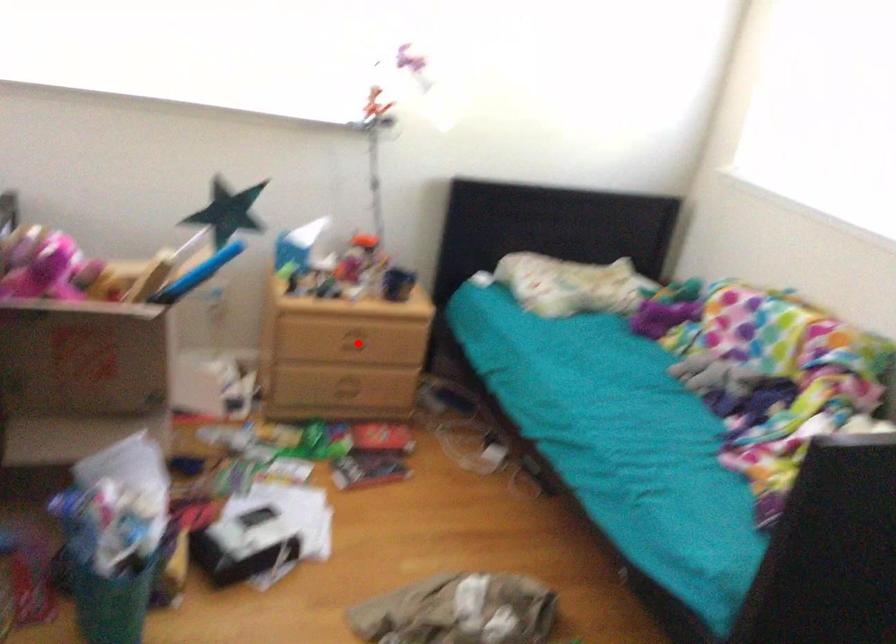
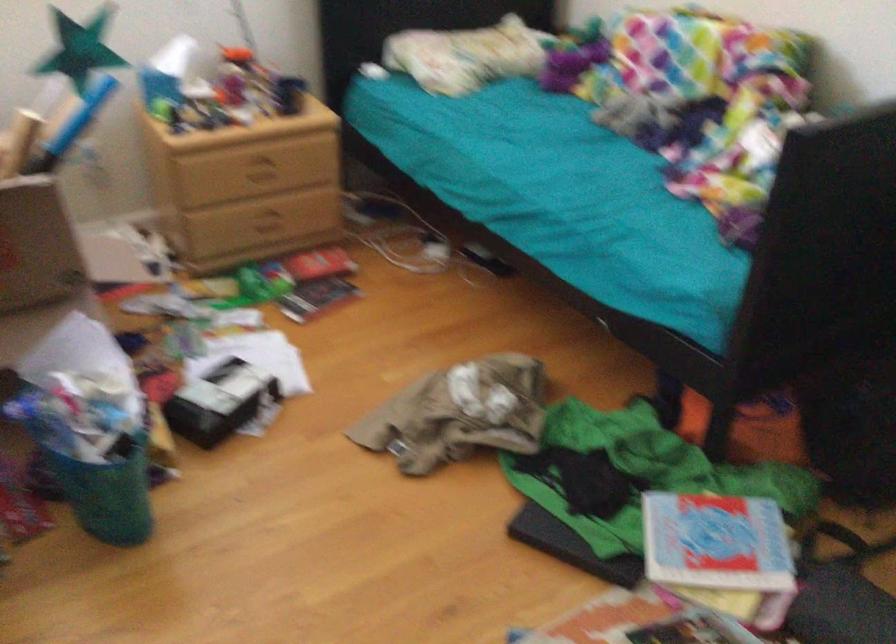
Locate, in the second image, the point that corresponds to the highlighted location in the first image.

(266, 172)